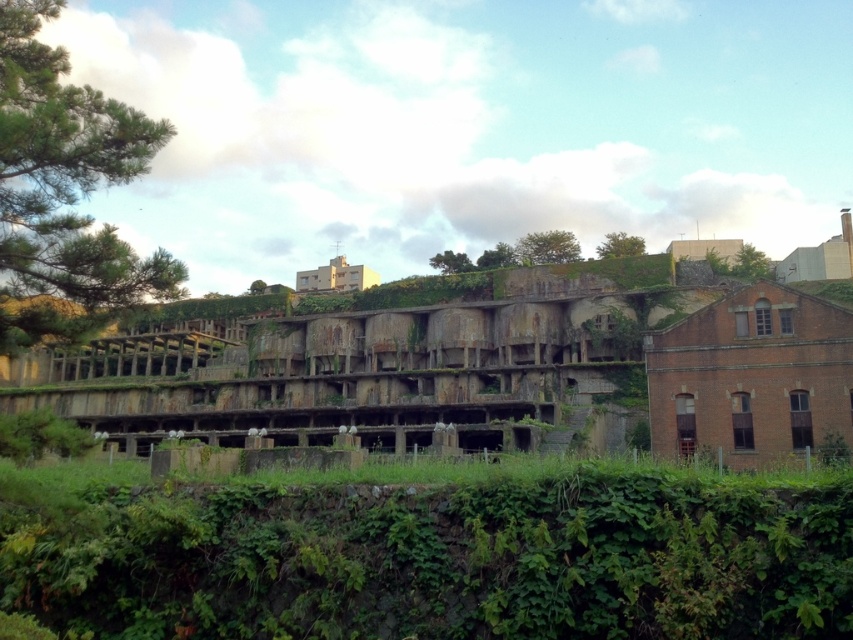
From the picture: You are a drone operator tasked with capturing aerial footage of the abandoned industrial structure. Your drone has a maximum flight distance of 100 feet from its starting position. If you are positioned at the camera location, can your drone reach the green leafy vegetation at center without exceeding its range?

The green leafy vegetation at center is 91.76 feet away from camera. Since the drone has a maximum flight distance of 100 feet, it can safely reach the green leafy vegetation at center without exceeding its range.

You are a hiker who wants to cross the steep incline in the foreground. You notice the green leafy vegetation at center and the rusty concrete ruins at center. Which of these two objects is taller and can provide a better vantage point for navigation?

The rusty concrete ruins at center are taller than the green leafy vegetation at center, so they can provide a better vantage point for navigation.

You are a botanist examining the abandoned industrial site. You notice two areas of green leafy vegetation at center and green leafy vegetation at upper center. Which area has a narrower width?

The green leafy vegetation at center has a narrower width compared to the green leafy vegetation at upper center.